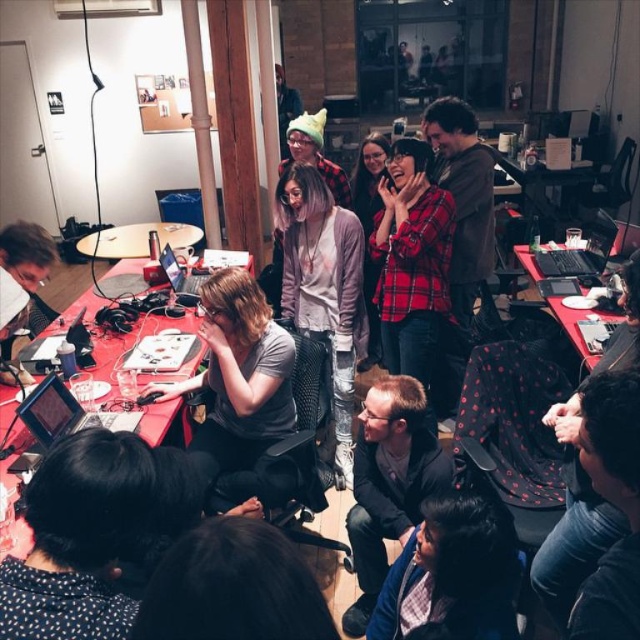
Question: Where is dark blue fabric jacket at lower center located in relation to black matte laptop at upper right in the image?

Choices:
 (A) right
 (B) left

Answer: (B)

Question: From the image, what is the correct spatial relationship of dark gray sweater at center in relation to black matte laptop at upper right?

Choices:
 (A) right
 (B) left

Answer: (B)

Question: Among these points, which one is nearest to the camera?

Choices:
 (A) (582, 358)
 (B) (180, 273)
 (C) (536, 253)

Answer: (A)

Question: Which is farther from the black matte laptop at upper right?

Choices:
 (A) dark blue fabric jacket at lower center
 (B) dark gray sweater at center

Answer: (A)

Question: Which object appears closest to the camera in this image?

Choices:
 (A) distressed denim jacket at center
 (B) dark gray sweater at center
 (C) matte black laptop at center
 (D) red plaid shirt at center

Answer: (B)

Question: Is dark blue fabric jacket at lower center bigger than black matte laptop at upper right?

Choices:
 (A) no
 (B) yes

Answer: (B)